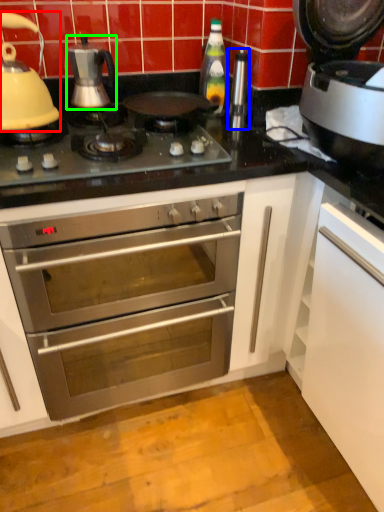
Question: Which object is the farthest from kitchen appliance (highlighted by a red box)? Choose among these: appliance (highlighted by a blue box) or kitchen appliance (highlighted by a green box).

Choices:
 (A) appliance
 (B) kitchen appliance

Answer: (A)